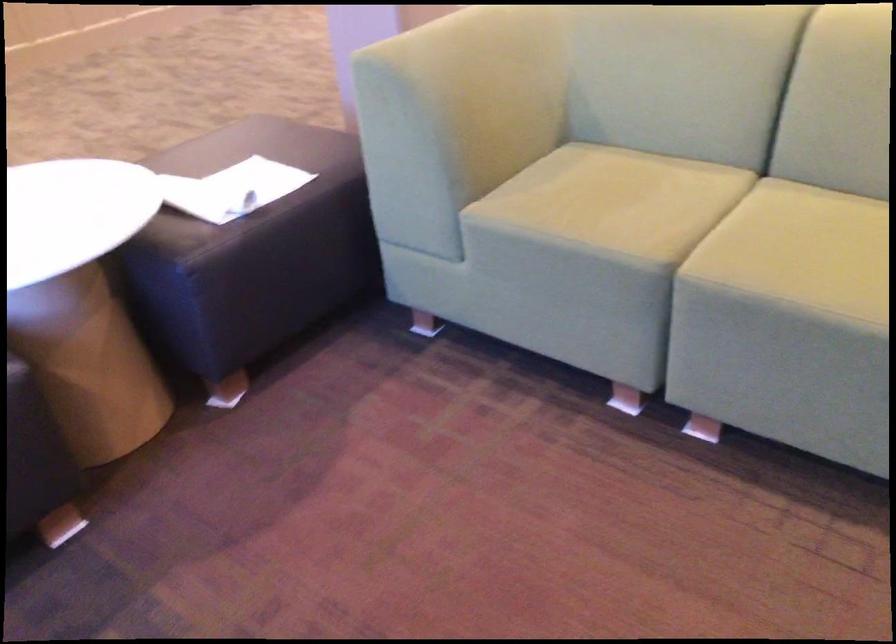
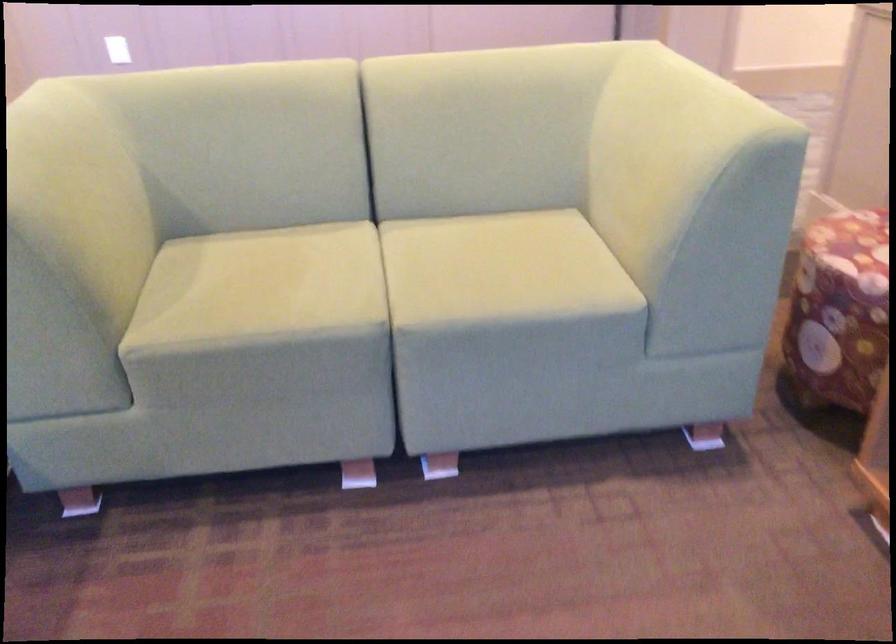
Question: The camera is either moving clockwise (left) or counter-clockwise (right) around the object. The first image is from the beginning of the video and the second image is from the end. Is the camera moving left or right when shooting the video?

Choices:
 (A) Left
 (B) Right

Answer: (A)